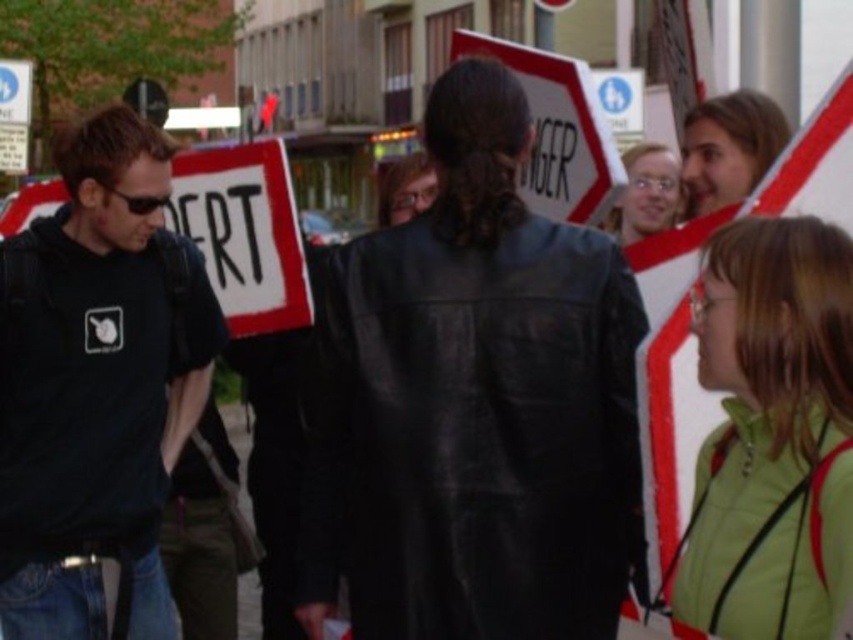
The image size is (853, 640). What are the coordinates of `light brown hair at upper right` in the screenshot? It's located at (728, 148).

Which is in front, point (730, 195) or point (672, 154)?

Point (730, 195) is in front.

Is point (699, 125) farther from viewer compared to point (619, 218)?

No, (699, 125) is closer to viewer.

Locate an element on the screen. light brown hair at upper right is located at coordinates [728, 148].

Measure the distance between black leather jacket at center and matte black jacket at upper right.

black leather jacket at center is 4.83 feet away from matte black jacket at upper right.

Is point (619, 512) more distant than point (657, 172)?

No.

Where is `black leather jacket at center`? The width and height of the screenshot is (853, 640). black leather jacket at center is located at coordinates (473, 404).

Consider the image. Can you confirm if black leather jacket at center is positioned above light brown hair at upper right?

No, black leather jacket at center is not above light brown hair at upper right.

In the scene shown: Is black leather jacket at center closer to the viewer compared to light brown hair at upper right?

Yes.

Does point (444, 312) come closer to viewer compared to point (699, 198)?

Yes, point (444, 312) is in front of point (699, 198).

The width and height of the screenshot is (853, 640). Find the location of `black leather jacket at center`. black leather jacket at center is located at coordinates (473, 404).